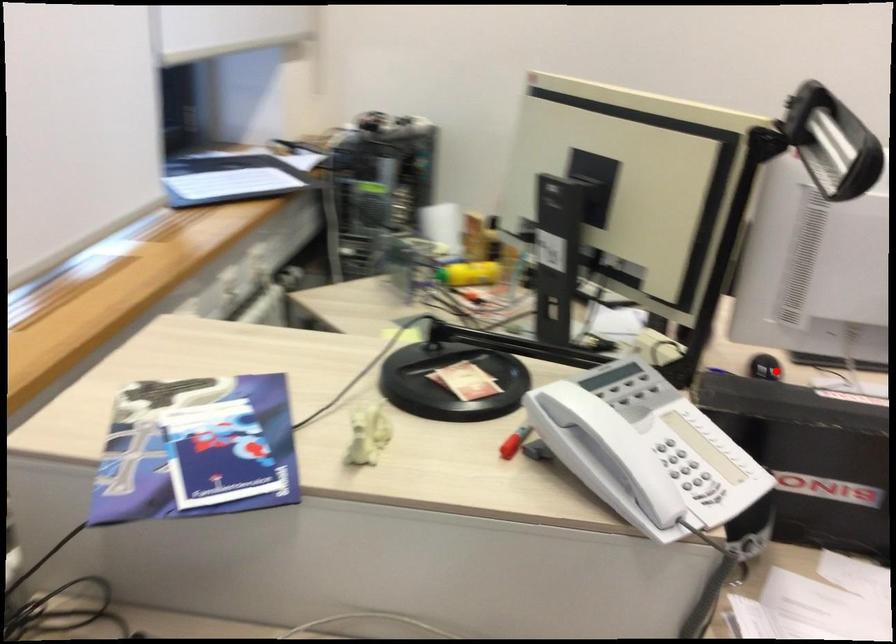
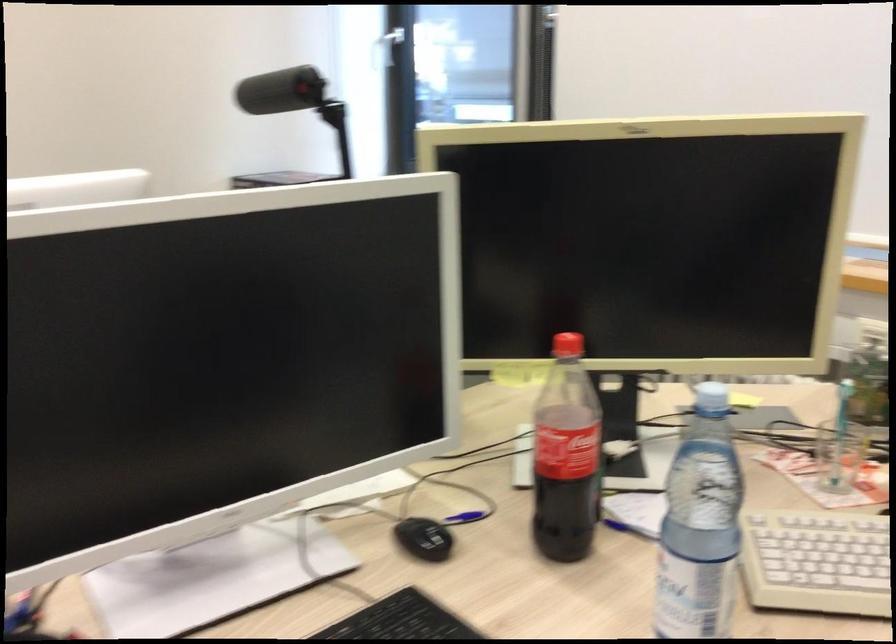
Locate, in the second image, the point that corresponds to the highlighted location in the first image.

(424, 538)